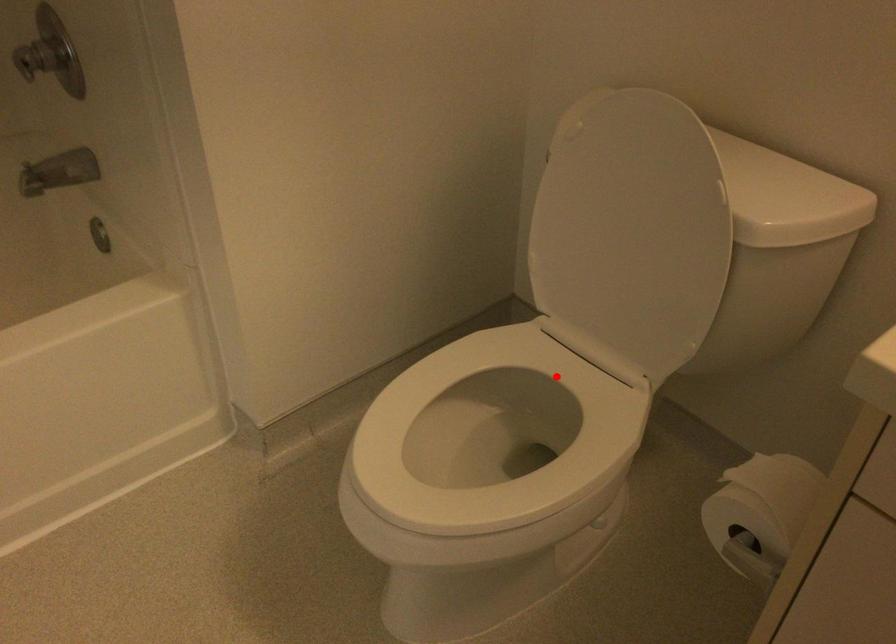
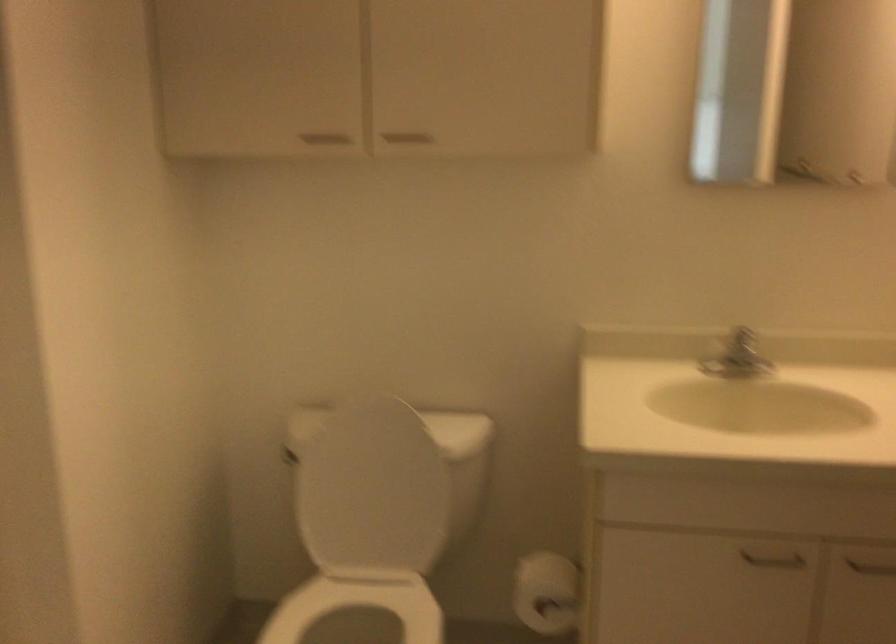
The point at the highlighted location is marked in the first image. Where is the corresponding point in the second image?

(357, 605)